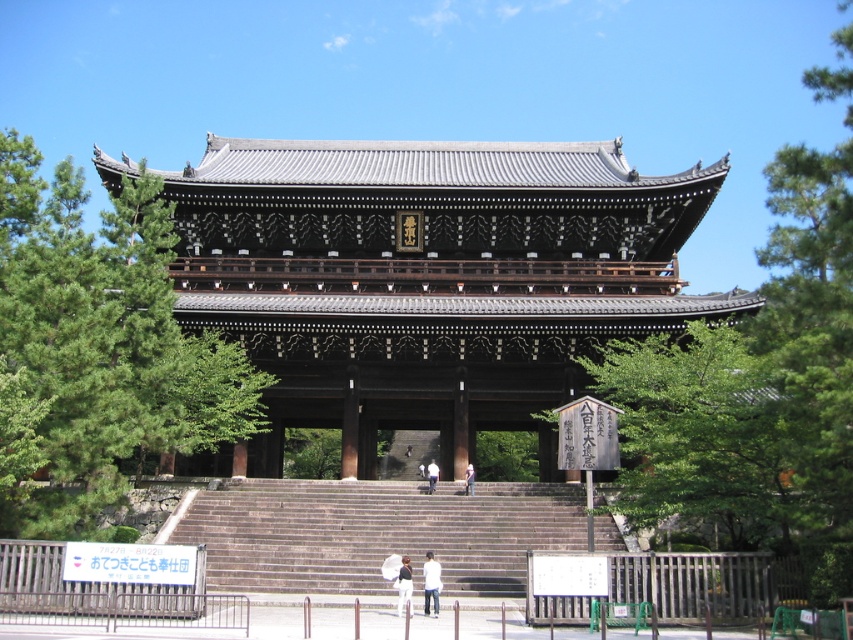
What is the exact coordinate of the white cotton shirt at center?

The white cotton shirt at center is located at point (431, 582).

You are standing in front of a traditional Japanese temple with a tiered roof and stone steps. You notice a white cotton shirt at center and a light brown wooden person at center. Which object is larger?

The white cotton shirt at center is bigger than the light brown wooden person at center.

You are standing at the bottom of the stone steps leading to the wooden temple gate at center. There is a light brown wooden person at center nearby. Which object is bigger in size?

The wooden temple gate at center is larger in size compared to the light brown wooden person at center.